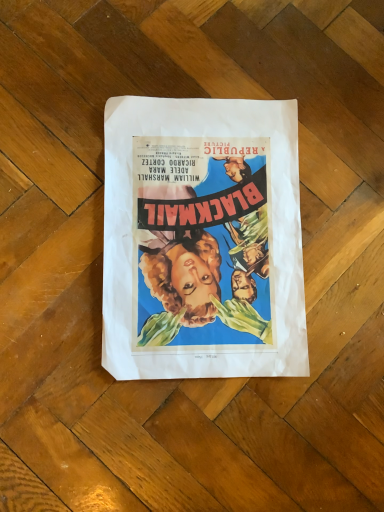
Identify the location of matte paper poster at center. (202, 239).

What do you see at coordinates (202, 239) in the screenshot? Image resolution: width=384 pixels, height=512 pixels. I see `matte paper poster at center` at bounding box center [202, 239].

Find the location of a particular element. matte paper poster at center is located at coordinates (202, 239).